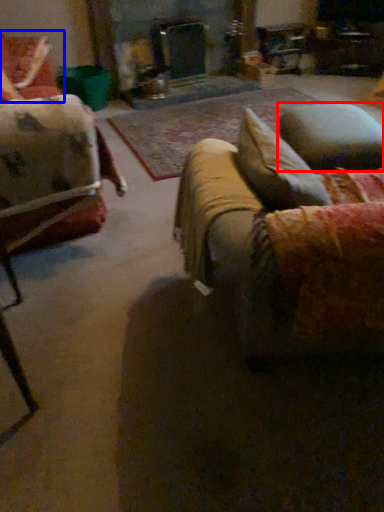
Question: Which object appears closest to the camera in this image, pillow (highlighted by a red box) or chair (highlighted by a blue box)?

Choices:
 (A) pillow
 (B) chair

Answer: (A)